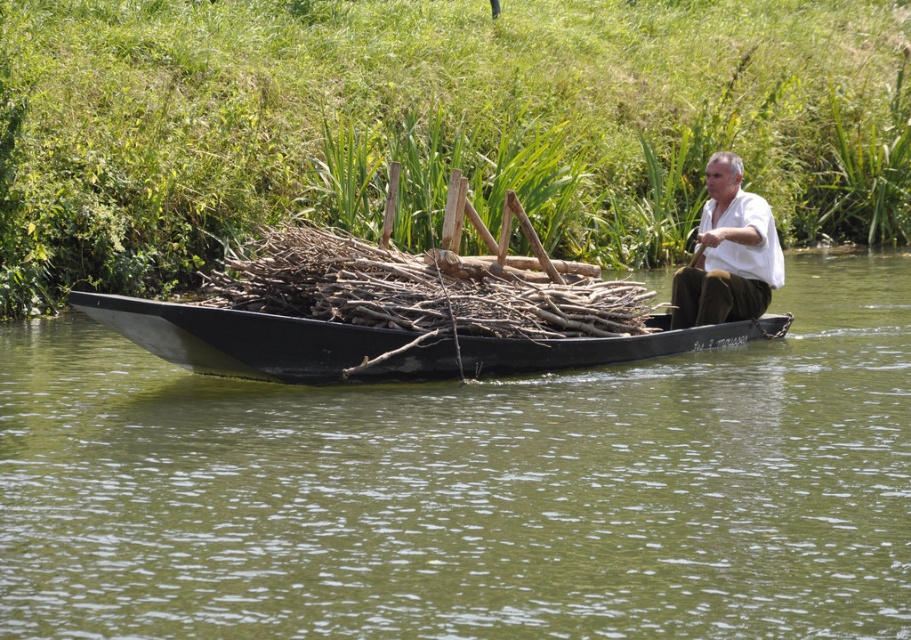
Is green grass at upper center positioned before white matte shirt at upper center?

No, it is not.

Describe the element at coordinates (431, 125) in the screenshot. The image size is (911, 640). I see `green grass at upper center` at that location.

Who is more forward, (29, 266) or (727, 202)?

Point (727, 202)

Find the location of a particular element. green grass at upper center is located at coordinates (431, 125).

What do you see at coordinates (431, 125) in the screenshot?
I see `green grass at upper center` at bounding box center [431, 125].

Can you confirm if green grass at upper center is smaller than brown rough wood at center?

No.

Is point (564, 29) positioned behind point (408, 282)?

That is True.

What are the coordinates of `green grass at upper center` in the screenshot? It's located at (431, 125).

Is the position of green water at boat center more distant than that of white matte shirt at upper center?

No, it is not.

Between green water at boat center and white matte shirt at upper center, which one is positioned higher?

Positioned higher is white matte shirt at upper center.

The image size is (911, 640). What do you see at coordinates (469, 490) in the screenshot?
I see `green water at boat center` at bounding box center [469, 490].

Where is `green water at boat center`? The width and height of the screenshot is (911, 640). green water at boat center is located at coordinates (469, 490).